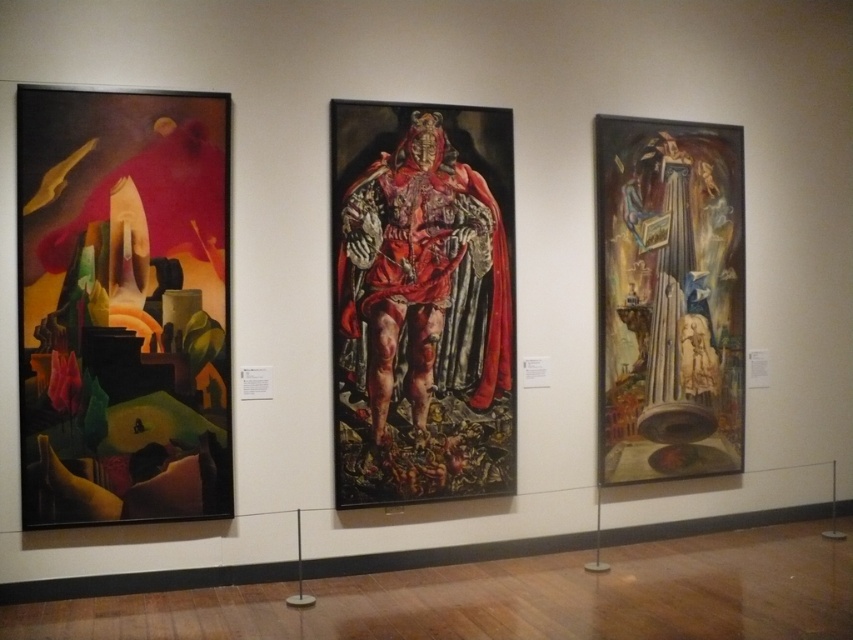
Question: Does oily canvas column at right have a smaller size compared to red velvet cape at center?

Choices:
 (A) yes
 (B) no

Answer: (B)

Question: Which object appears closest to the camera in this image?

Choices:
 (A) red velvet cape at center
 (B) abstract painting at left
 (C) oily canvas column at right

Answer: (B)

Question: Which of the following is the farthest from the observer?

Choices:
 (A) oily canvas column at right
 (B) red velvet cape at center

Answer: (A)

Question: Is abstract painting at left thinner than oily canvas column at right?

Choices:
 (A) yes
 (B) no

Answer: (A)

Question: Which of the following is the closest to the observer?

Choices:
 (A) red velvet cape at center
 (B) abstract painting at left

Answer: (B)

Question: Can you confirm if abstract painting at left is smaller than oily canvas column at right?

Choices:
 (A) yes
 (B) no

Answer: (A)